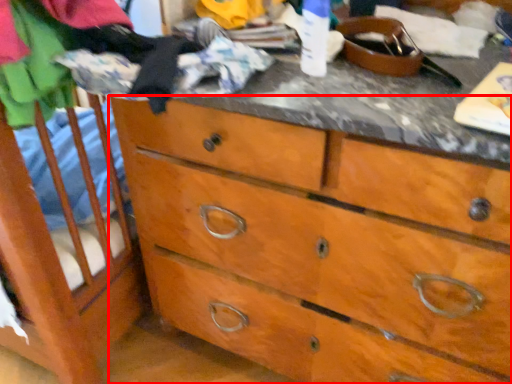
Question: In this image, where is chest of drawers (annotated by the red box) located relative to clothing?

Choices:
 (A) left
 (B) right

Answer: (B)